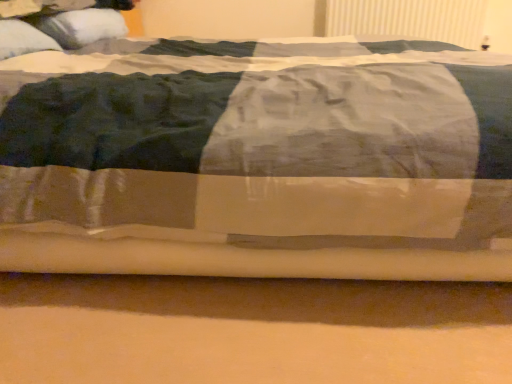
Question: Relative to white soft pillow at upper left, which appears as the 2th pillow when viewed from the front, is white textured radiator at upper right in front or behind?

Choices:
 (A) behind
 (B) front

Answer: (A)

Question: Is white textured radiator at upper right situated inside white soft pillow at upper left, which appears as the 2th pillow when viewed from the front, or outside?

Choices:
 (A) outside
 (B) inside

Answer: (A)

Question: Estimate the real-world distances between objects in this image. Which object is farther from the white textured radiator at upper right?

Choices:
 (A) white soft pillow at upper left, which appears as the second pillow when viewed from the back
 (B) white soft pillow at upper left, which appears as the 2th pillow when viewed from the front

Answer: (A)

Question: Based on their relative distances, which object is farther from the white textured radiator at upper right?

Choices:
 (A) white soft pillow at upper left, the first pillow from the front
 (B) white soft pillow at upper left, which appears as the 2th pillow when viewed from the front

Answer: (A)